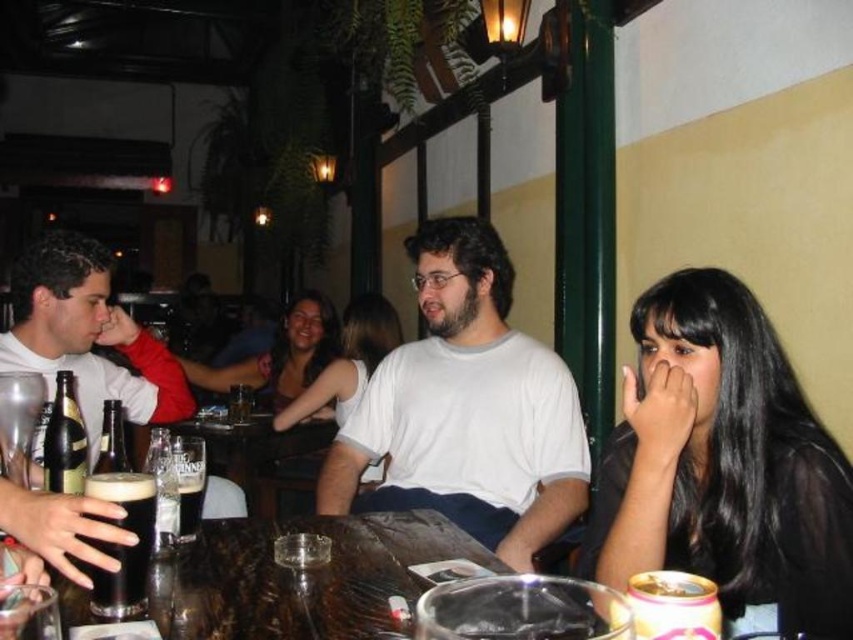
You are a photographer setting up for an event and need to position two subjects wearing the matte black shirt at left and the matte black dress at center. Since space is limited, which subject should you place first to ensure both can fit comfortably?

The matte black shirt at left should be placed first because it occupies less space than the matte black dress at center, allowing both to fit comfortably in the limited space.

You are a server at the pub and need to deliver a tray of drinks to the table. You notice the black hair at right and the dark matte glass at table center. Which object is closer to the ceiling?

The black hair at right is taller than the dark matte glass at table center, so the black hair at right is closer to the ceiling.